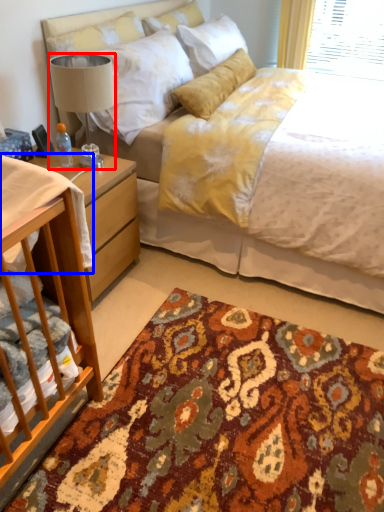
Question: Which object is closer to the camera taking this photo, lamp (highlighted by a red box) or sheet (highlighted by a blue box)?

Choices:
 (A) lamp
 (B) sheet

Answer: (B)